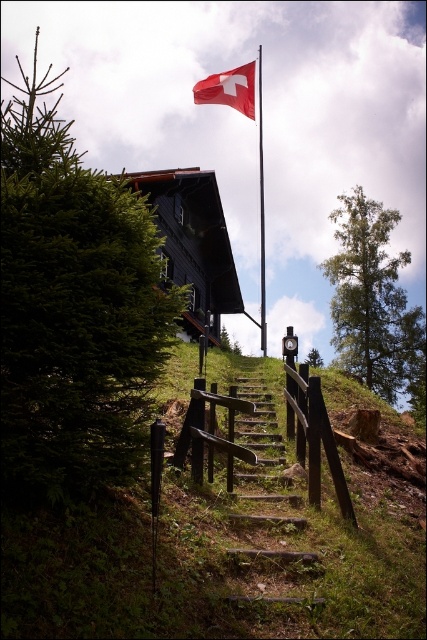
Between wooden stairs at center and black wooden cabin at center, which one is positioned lower?

wooden stairs at center is lower down.

Is point (268, 588) less distant than point (184, 220)?

That is True.

Where is `wooden stairs at center`? The width and height of the screenshot is (427, 640). wooden stairs at center is located at coordinates (269, 508).

Does red fabric flag at upper center have a greater height compared to metallic flag pole at upper center?

Incorrect, red fabric flag at upper center's height is not larger of metallic flag pole at upper center's.

Is red fabric flag at upper center to the left of metallic flag pole at upper center from the viewer's perspective?

Yes, red fabric flag at upper center is to the left of metallic flag pole at upper center.

Locate an element on the screen. red fabric flag at upper center is located at coordinates pyautogui.click(x=228, y=90).

Which is more to the right, black wooden cabin at center or red fabric flag at upper center?

From the viewer's perspective, red fabric flag at upper center appears more on the right side.

Does black wooden cabin at center have a lesser height compared to red fabric flag at upper center?

In fact, black wooden cabin at center may be taller than red fabric flag at upper center.

Who is more distant from viewer, (x=219, y=244) or (x=231, y=100)?

Positioned behind is point (x=219, y=244).

Find the location of a particular element. black wooden cabin at center is located at coordinates (193, 244).